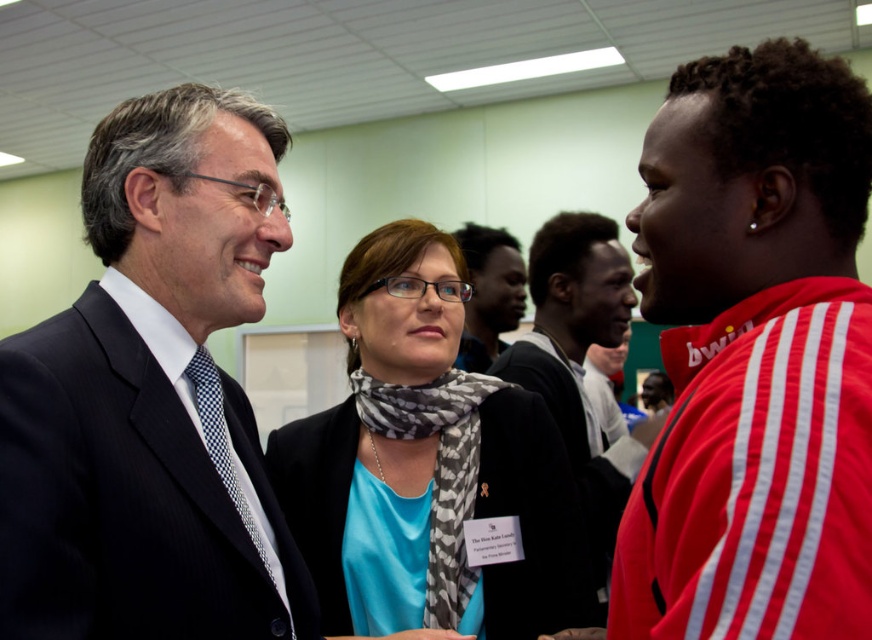
Which is below, blue fabric scarf at center or matte black suit at center?

blue fabric scarf at center

Between blue fabric scarf at center and matte black suit at center, which one has more height?

With more height is blue fabric scarf at center.

The image size is (872, 640). What do you see at coordinates (426, 467) in the screenshot? I see `blue fabric scarf at center` at bounding box center [426, 467].

Locate an element on the screen. The image size is (872, 640). blue fabric scarf at center is located at coordinates (426, 467).

Is red fabric shirt at right to the right of dark skin textured face at center from the viewer's perspective?

Incorrect, red fabric shirt at right is not on the right side of dark skin textured face at center.

Between red fabric shirt at right and dark skin textured face at center, which one appears on the right side from the viewer's perspective?

dark skin textured face at center

Is point (731, 228) in front of point (591, 436)?

Yes, it is.

Find the location of a particular element. red fabric shirt at right is located at coordinates (754, 355).

Is blue fabric scarf at center behind dark skin textured face at center?

No.

Consider the image. Who is positioned more to the right, blue fabric scarf at center or dark skin textured face at center?

From the viewer's perspective, dark skin textured face at center appears more on the right side.

In the scene shown: Who is more distant from viewer, (329, 420) or (584, 320)?

Point (584, 320)

Identify the location of blue fabric scarf at center. (426, 467).